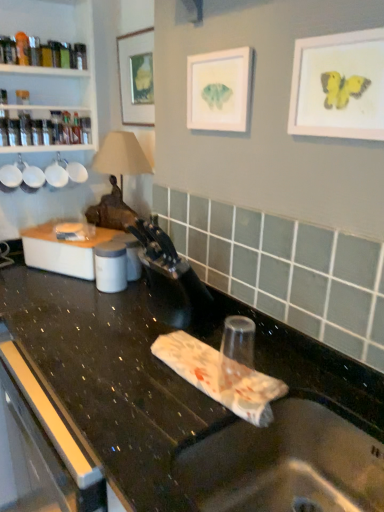
Question: From a real-world perspective, is matte paper picture frame at center, marked as the second picture frame in a front-to-back arrangement, physically located above or below black granite countertop at center?

Choices:
 (A) below
 (B) above

Answer: (B)

Question: In terms of size, does matte paper picture frame at center, marked as the second picture frame in a front-to-back arrangement, appear bigger or smaller than black granite countertop at center?

Choices:
 (A) big
 (B) small

Answer: (B)

Question: Which object is positioned farthest from the matte white picture frame at upper center, the third picture frame viewed from the front?

Choices:
 (A) white plastic container at left
 (B) matte yellow butterfly at upper right, which is the first picture frame from right to left
 (C) matte paper picture frame at center, which appears as the second picture frame when viewed from the right
 (D) black plastic faucet at center
 (E) black granite countertop at center

Answer: (E)

Question: Which is farther from the metallic stainless steel sink at lower center?

Choices:
 (A) matte paper picture frame at center, which appears as the second picture frame when viewed from the right
 (B) white plastic container at left
 (C) matte yellow butterfly at upper right, positioned as the 3th picture frame in back-to-front order
 (D) black granite countertop at center
 (E) black plastic faucet at center

Answer: (B)